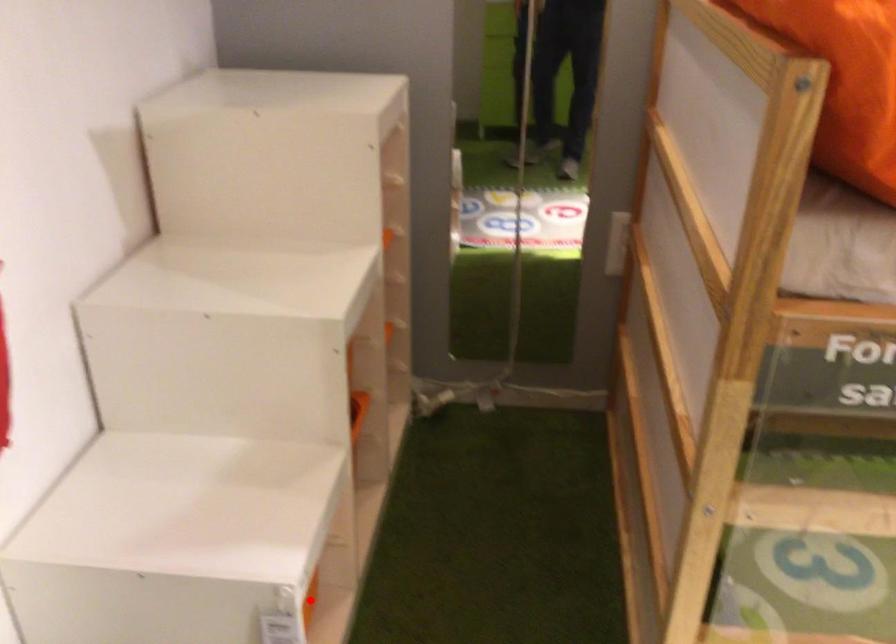
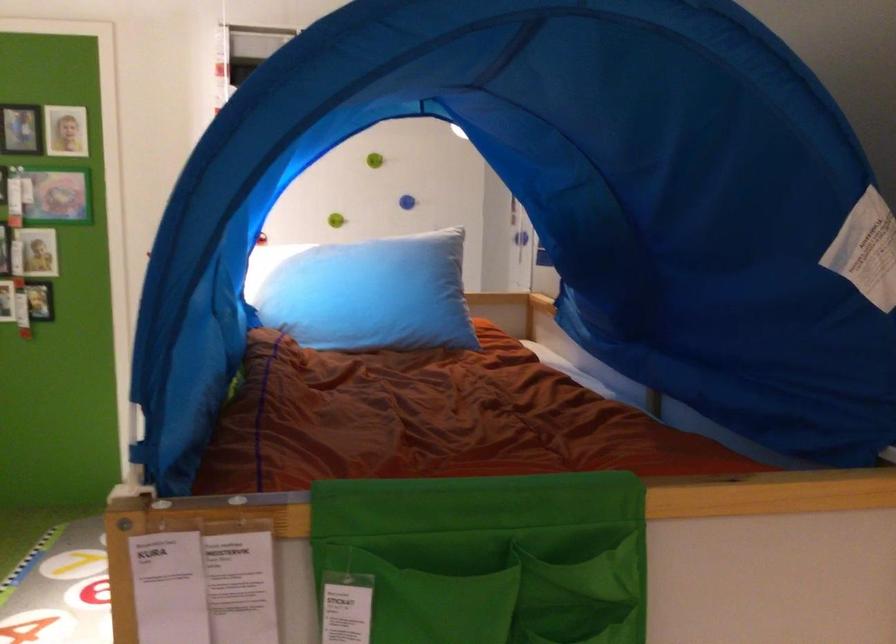
Question: I am providing you with two images of the same scene from different viewpoints. A red point is marked on the first image. At the location where the point appears in image 1, is it still visible in image 2?

Choices:
 (A) Yes
 (B) No

Answer: (B)